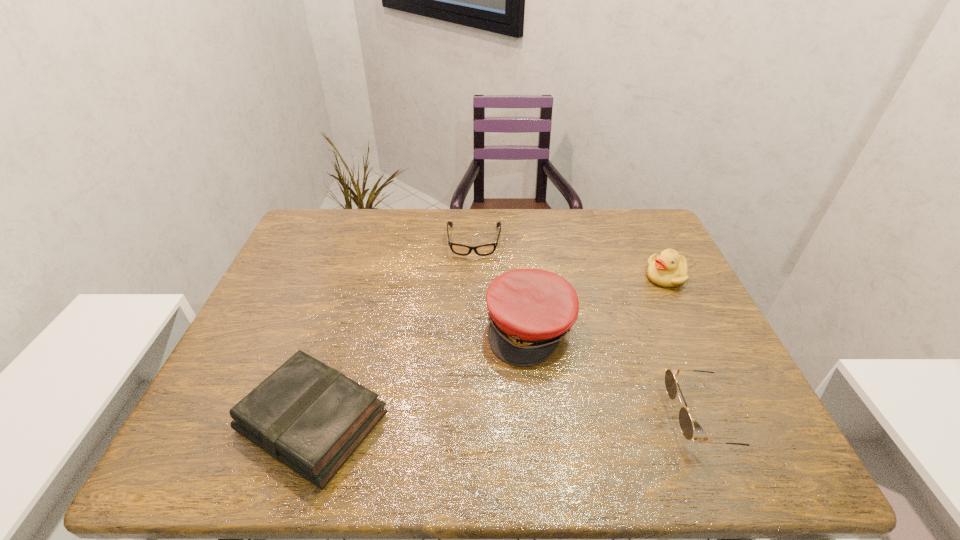
This screenshot has width=960, height=540. Find the location of `free space at the left edge of the desktop`. free space at the left edge of the desktop is located at coordinates (241, 336).

Find the location of a particular element. The image size is (960, 540). vacant area at the right edge is located at coordinates (711, 338).

Where is `vacant space at the far left corner`? The height and width of the screenshot is (540, 960). vacant space at the far left corner is located at coordinates (343, 232).

The image size is (960, 540). In the image, there is a desktop. Find the location of `vacant space at the near right corner`. vacant space at the near right corner is located at coordinates (706, 400).

Identify the location of unoccupied area between the fourth nearest object and the sunglasses. The width and height of the screenshot is (960, 540). (685, 347).

Where is `vacant region between the spectacles and the fourth nearest object`? The height and width of the screenshot is (540, 960). vacant region between the spectacles and the fourth nearest object is located at coordinates coord(570,259).

Where is `vacant area between the spectacles and the second farthest object`? The width and height of the screenshot is (960, 540). vacant area between the spectacles and the second farthest object is located at coordinates (570, 259).

Identify the location of vacant area between the sunglasses and the fourth nearest object. This screenshot has height=540, width=960. (685, 347).

Locate an element on the screen. The image size is (960, 540). empty space that is in between the sunglasses and the spectacles is located at coordinates (589, 329).

The image size is (960, 540). Identify the location of unoccupied position between the second farthest object and the leftmost object. (490, 349).